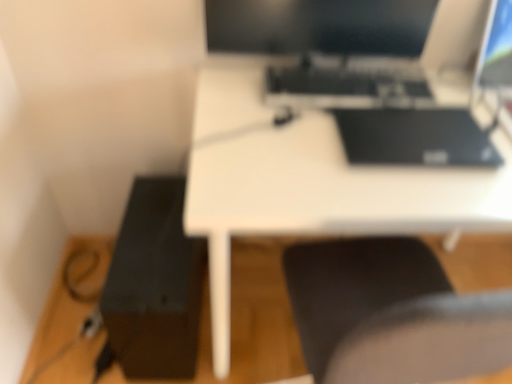
I want to click on free space in front of black matte keyboard at center, so click(350, 175).